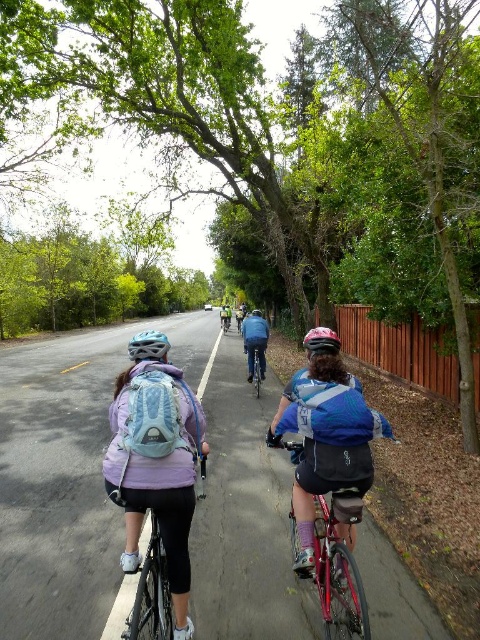
Question: Is matte blue backpack at left above blue fabric jacket at center?

Choices:
 (A) no
 (B) yes

Answer: (B)

Question: Which of the following is the farthest from the observer?

Choices:
 (A) (326, 506)
 (B) (159, 353)
 (C) (222, 320)
 (D) (256, 372)

Answer: (C)

Question: Is blue fabric jacket at center to the left of shiny blue helmet at center from the viewer's perspective?

Choices:
 (A) yes
 (B) no

Answer: (B)

Question: Is blue denim jacket at center above white matte bicycle helmet at center?

Choices:
 (A) no
 (B) yes

Answer: (A)

Question: Among these objects, which one is nearest to the camera?

Choices:
 (A) blue fabric jacket at center
 (B) shiny silver bicycle at center
 (C) blue denim jacket at center

Answer: (A)

Question: Which object appears farthest from the camera in this image?

Choices:
 (A) shiny red bicycle at center
 (B) blue fabric jacket at center
 (C) matte black helmet at center

Answer: (C)